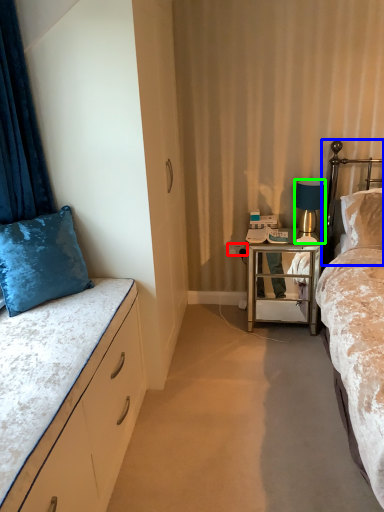
Question: Estimate the real-world distances between objects in this image. Which object is closer to power outlet (highlighted by a red box), headboard (highlighted by a blue box) or lamp (highlighted by a green box)?

Choices:
 (A) headboard
 (B) lamp

Answer: (B)